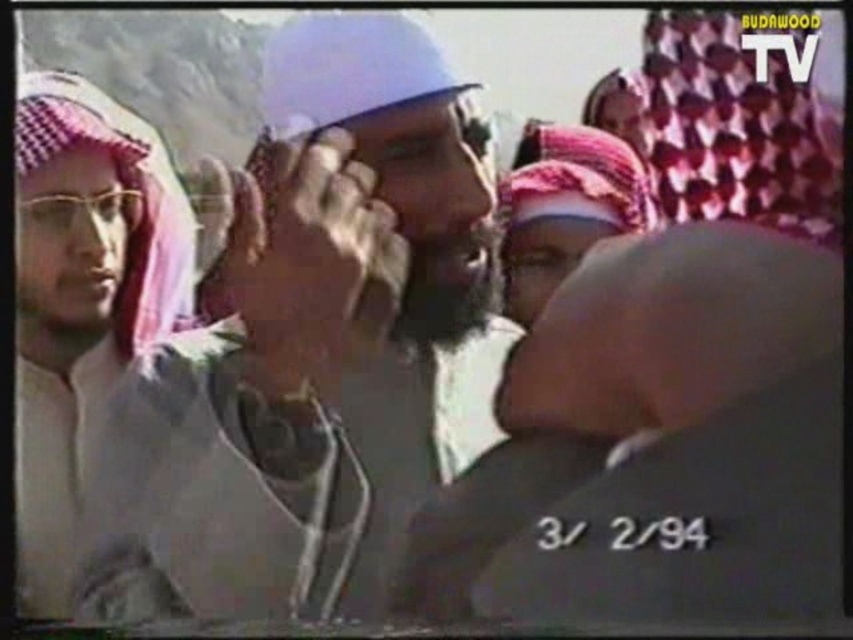
Based on the scene description, where is the white matte headscarf at center located in the image?

The white matte headscarf at center is located at point [297,356].

You are a photographer trying to capture a clear shot of both the white matte headscarf at center and the white checkered headscarf at left. Which one will appear larger in your photo?

The white matte headscarf at center will appear larger in the photo because it is closer to the viewer than the white checkered headscarf at left.